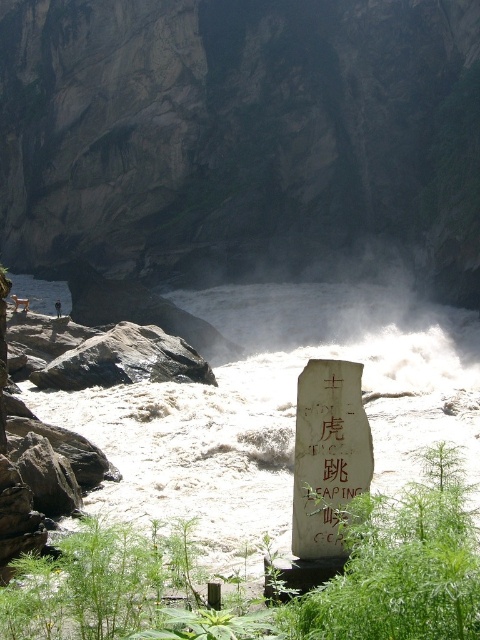
Question: Which point is farther to the camera?

Choices:
 (A) gray rock at left
 (B) white stone sign at center
 (C) dark brown leather jacket at upper center

Answer: (C)

Question: Can you confirm if white frothy water at center is bigger than white stone sign at center?

Choices:
 (A) no
 (B) yes

Answer: (B)

Question: Does white frothy water at center appear on the left side of gray rock at left?

Choices:
 (A) yes
 (B) no

Answer: (B)

Question: Which of the following is the farthest from the observer?

Choices:
 (A) white frothy water at center
 (B) dark brown leather jacket at upper center
 (C) white stone sign at center
 (D) gray rock at left

Answer: (B)

Question: Which of the following is the closest to the observer?

Choices:
 (A) (122, 348)
 (B) (325, 531)

Answer: (B)

Question: Does white frothy water at center appear on the left side of white stone sign at center?

Choices:
 (A) no
 (B) yes

Answer: (B)